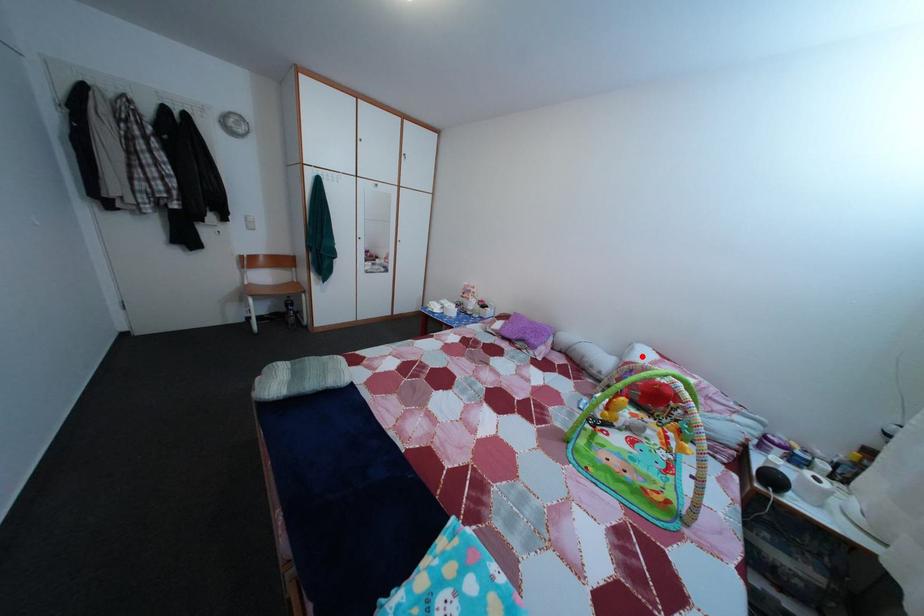
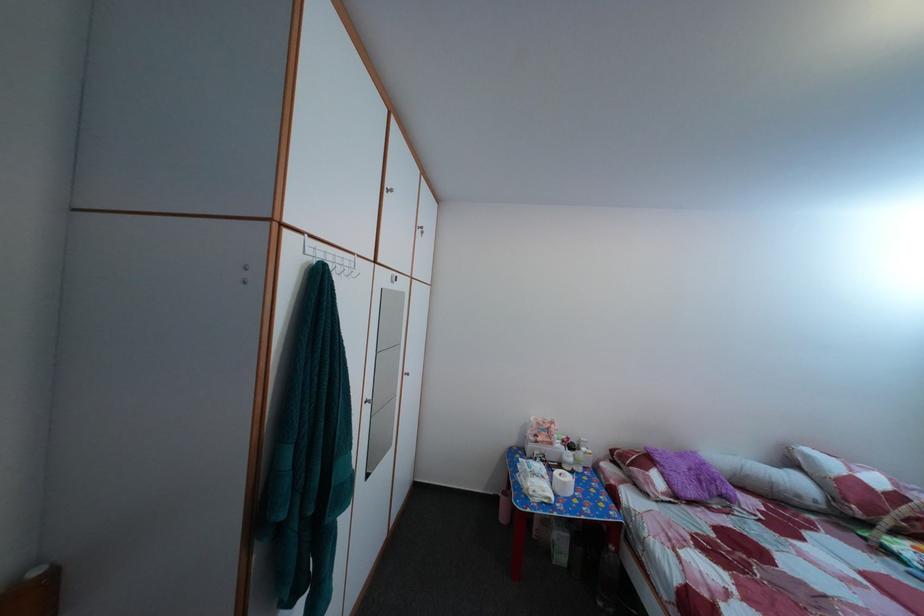
Locate, in the second image, the point that corresponds to the highlighted location in the first image.

(817, 464)